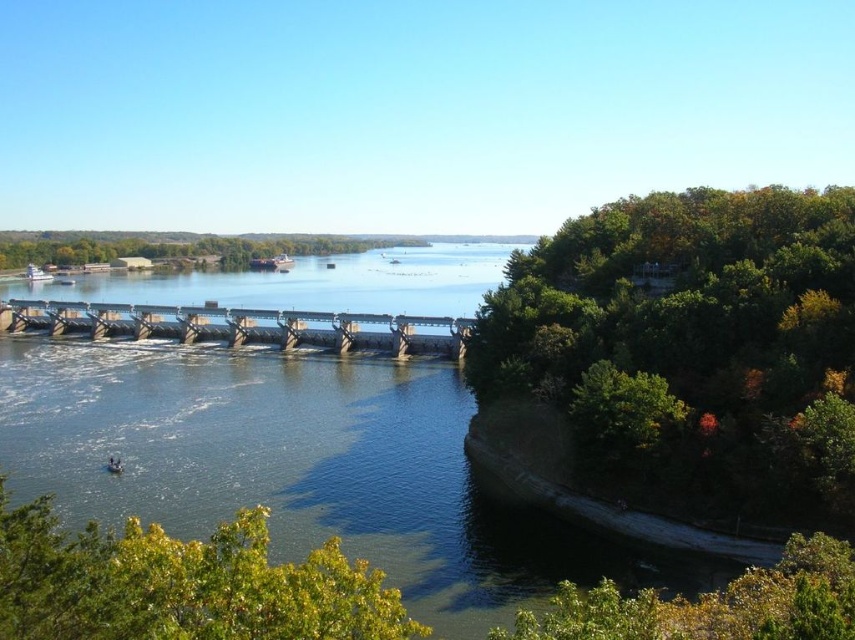
Between point (97, 593) and point (276, 269), which one is positioned in front?

Point (97, 593) is more forward.

Find the location of a particular element. Image resolution: width=855 pixels, height=640 pixels. green leafy tree at lower left is located at coordinates (181, 584).

Between white plastic boat at left and white plastic boat at center, which one is positioned lower?

white plastic boat at left

Who is positioned more to the right, white plastic boat at left or white plastic boat at center?

From the viewer's perspective, white plastic boat at center appears more on the right side.

Does point (24, 273) come behind point (286, 260)?

No, it is in front of (286, 260).

You are a GUI agent. You are given a task and a screenshot of the screen. Output one action in this format:
    pyautogui.click(x=<x>, y=<y>)
    Task: Click on the white plastic boat at left
    This screenshot has width=855, height=640.
    Given the screenshot: What is the action you would take?
    pyautogui.click(x=36, y=273)

Does green leafy trees at right have a smaller size compared to green leafy tree at lower left?

Incorrect, green leafy trees at right is not smaller in size than green leafy tree at lower left.

Is green leafy trees at right shorter than green leafy tree at lower left?

No, green leafy trees at right is not shorter than green leafy tree at lower left.

Measure the distance between green leafy trees at right and camera.

They are 162.08 feet apart.

Where is `green leafy trees at right`? This screenshot has width=855, height=640. green leafy trees at right is located at coordinates (691, 342).